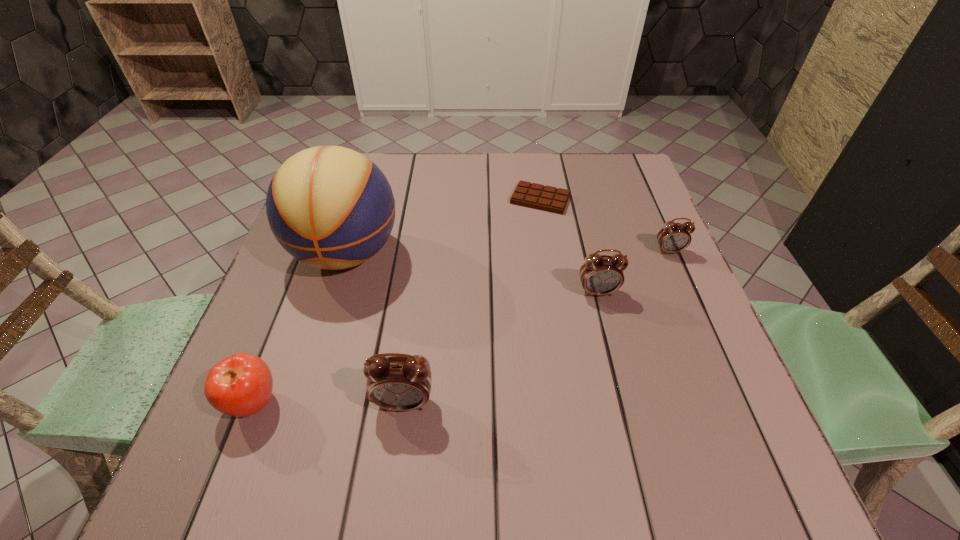
To achieve uniform spacing by inserting another alarm_clock among them, please point to a free space for this new alarm_clock. Please provide its 2D coordinates. Your answer should be formatted as a tuple, i.e. [(x, y)], where the tuple contains the x and y coordinates of a point satisfying the conditions above.

[(511, 341)]